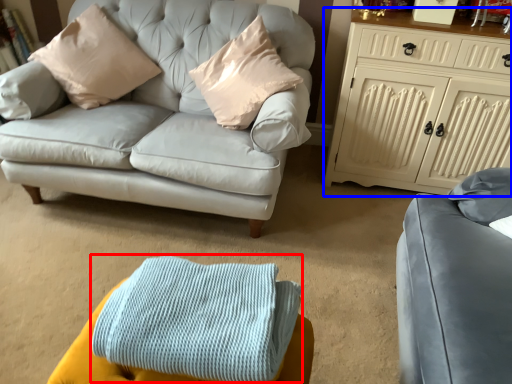
Question: Which of the following is the closest to the observer, blanket (highlighted by a red box) or cabinetry (highlighted by a blue box)?

Choices:
 (A) blanket
 (B) cabinetry

Answer: (A)